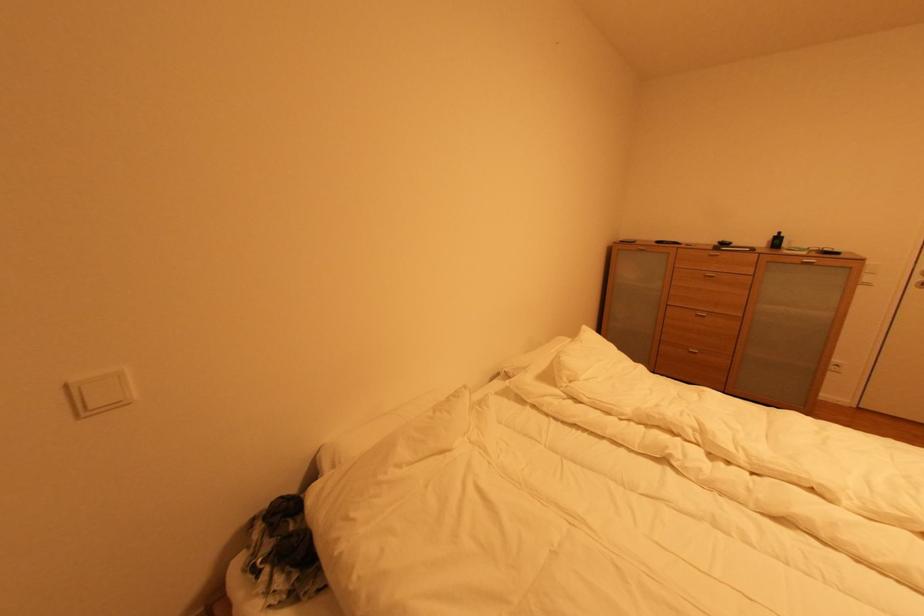
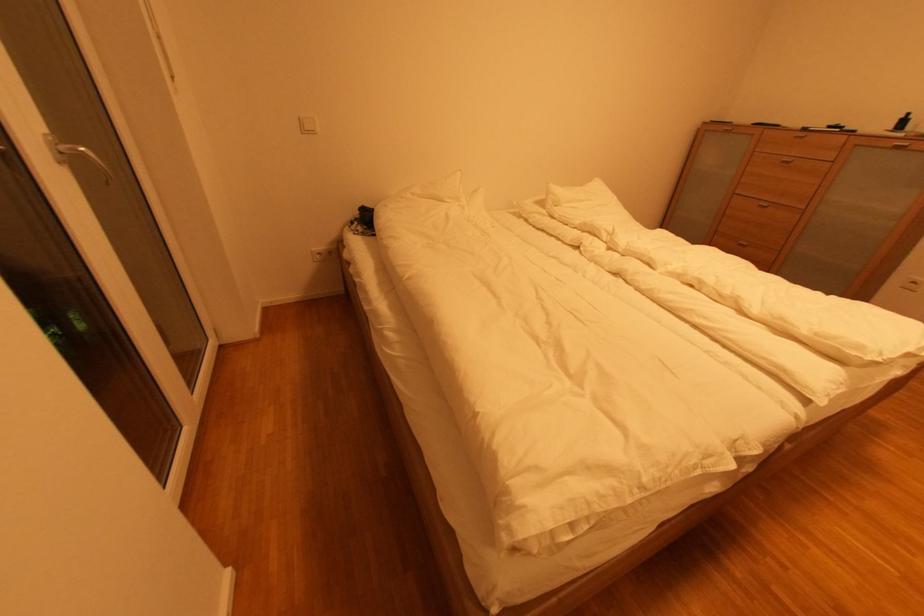
The point at [710,318] is marked in the first image. Where is the corresponding point in the second image?

(772, 208)